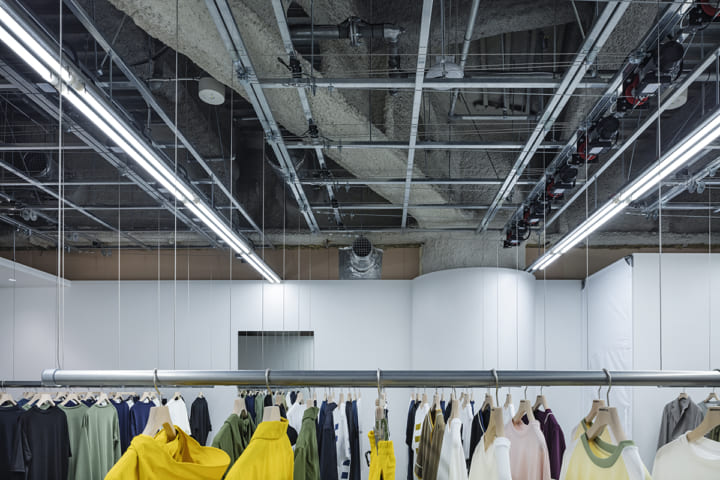
Find the location of a particular element. The height and width of the screenshot is (480, 720). rods is located at coordinates (567, 248).